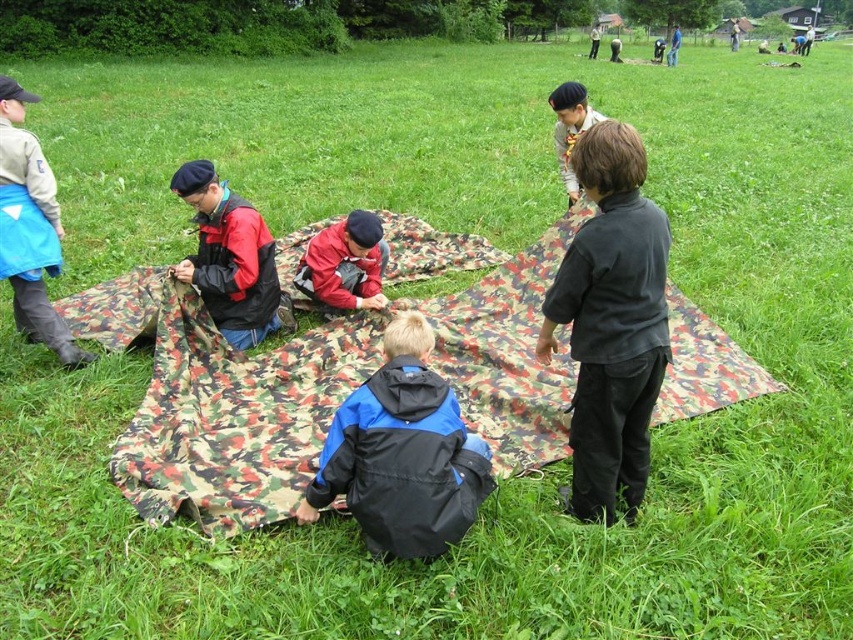
Question: Where is camouflage fabric blanket at center located in relation to matte black jacket at center in the image?

Choices:
 (A) left
 (B) right

Answer: (B)

Question: Which point is farther from the camera taking this photo?

Choices:
 (A) (218, 269)
 (B) (334, 307)
 (C) (28, 260)
 (D) (361, 474)

Answer: (B)

Question: Estimate the real-world distances between objects in this image. Which object is farther from the matte black jacket at center?

Choices:
 (A) red matte jacket at center
 (B) blue/black jacket at center
 (C) dark gray shirt at center
 (D) blue fabric apron at left

Answer: (C)

Question: Can you confirm if camouflage fabric blanket at center is positioned below blue fabric apron at left?

Choices:
 (A) no
 (B) yes

Answer: (B)

Question: Is matte black jacket at center to the right of red matte jacket at center from the viewer's perspective?

Choices:
 (A) no
 (B) yes

Answer: (A)

Question: Which point is farther to the camera?

Choices:
 (A) blue fabric apron at left
 (B) dark gray fleece jacket at upper center
 (C) dark gray shirt at center

Answer: (B)